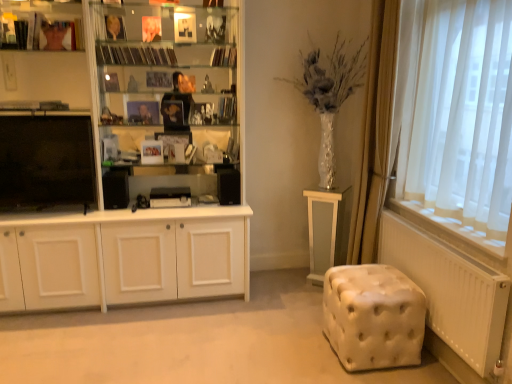
Image resolution: width=512 pixels, height=384 pixels. Identify the location of vacant region above matte black books at upper left (from a real-world perspective). (38, 7).